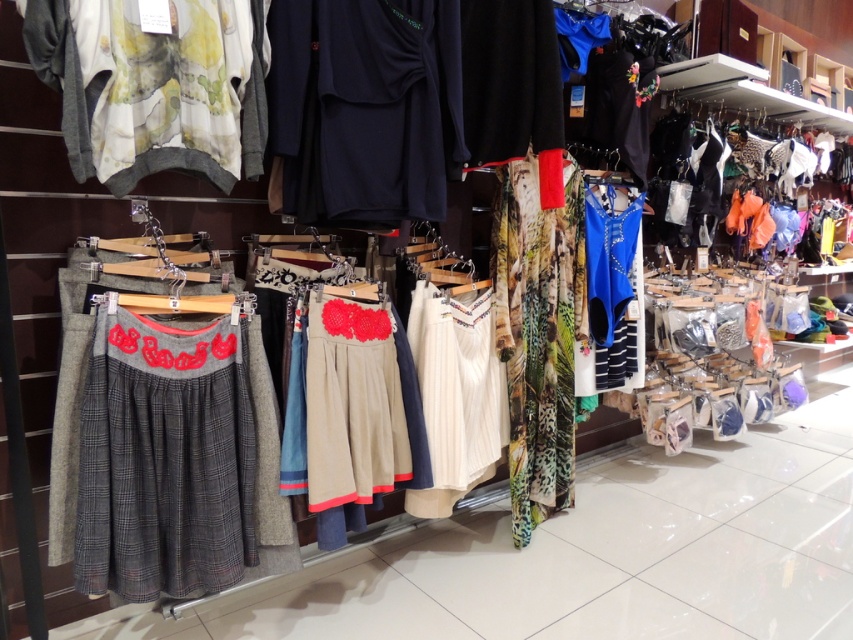
You are a customer in the clothing store and want to know which garment is larger between the watercolor fabric blouse at upper left and the black matte sweater at center. Can you tell me?

The watercolor fabric blouse at upper left is bigger than the black matte sweater at center.

Based on the photo, you are a customer in the clothing store looking at the watercolor fabric blouse at upper left and the beige fabric skirt at center. Which garment is positioned higher on the rack?

The watercolor fabric blouse at upper left is positioned higher on the rack than the beige fabric skirt at center.

From the picture: You are a customer in the clothing store looking at the skirts and tops. You notice a point marked at coordinates (164, 460). What item is located at that point?

The point at (164, 460) corresponds to the plaid wool skirt at center.